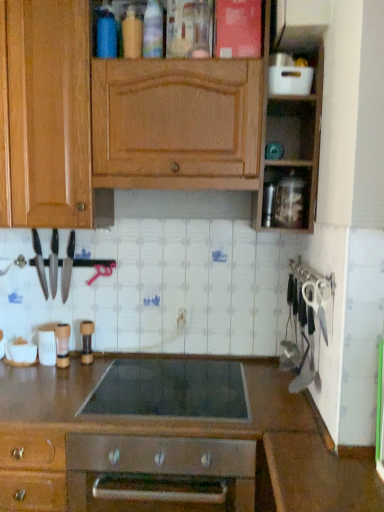
Question: Would you say wooden cabinet at upper center contains white plastic scissors at right?

Choices:
 (A) yes
 (B) no

Answer: (B)

Question: From a real-world perspective, is wooden cabinet at upper center physically below white plastic scissors at right?

Choices:
 (A) no
 (B) yes

Answer: (A)

Question: Could you tell me if wooden cabinet at upper center is turned towards white plastic scissors at right?

Choices:
 (A) yes
 (B) no

Answer: (B)

Question: Is wooden cabinet at upper center positioned far away from white plastic scissors at right?

Choices:
 (A) yes
 (B) no

Answer: (B)

Question: Does wooden cabinet at upper center have a greater width compared to white plastic scissors at right?

Choices:
 (A) yes
 (B) no

Answer: (A)

Question: Considering the positions of point (43, 270) and point (66, 326), is point (43, 270) closer or farther from the camera than point (66, 326)?

Choices:
 (A) farther
 (B) closer

Answer: (B)

Question: Which is correct: black metal knife at left, which ranks as the first kitchen appliance in left-to-right order, is inside clear plastic container at lower left, acting as the 4th appliance starting from the top, or outside of it?

Choices:
 (A) outside
 (B) inside

Answer: (A)

Question: In terms of height, does black metal knife at left, which ranks as the first kitchen appliance in left-to-right order, look taller or shorter compared to clear plastic container at lower left, the 3th appliance when ordered from left to right?

Choices:
 (A) short
 (B) tall

Answer: (B)

Question: From a real-world perspective, is black metal knife at left, which ranks as the first kitchen appliance in left-to-right order, positioned above or below clear plastic container at lower left, acting as the 4th appliance starting from the top?

Choices:
 (A) above
 (B) below

Answer: (A)

Question: Considering the positions of polished stainless steel knives at left, the first kitchen appliance viewed from the right, and white plastic scissors at right in the image, is polished stainless steel knives at left, the first kitchen appliance viewed from the right, taller or shorter than white plastic scissors at right?

Choices:
 (A) tall
 (B) short

Answer: (A)

Question: Which is correct: polished stainless steel knives at left, the first kitchen appliance viewed from the right, is inside white plastic scissors at right, or outside of it?

Choices:
 (A) inside
 (B) outside

Answer: (B)

Question: Is polished stainless steel knives at left, the 3th kitchen appliance positioned from the left, bigger or smaller than white plastic scissors at right?

Choices:
 (A) small
 (B) big

Answer: (B)

Question: Does point (61, 267) appear closer or farther from the camera than point (317, 309)?

Choices:
 (A) farther
 (B) closer

Answer: (A)

Question: From a real-world perspective, is polished stainless steel knives at left, the first kitchen appliance viewed from the right, above or below brown matte pepper grinder at center, which is the fourth appliance from bottom to top?

Choices:
 (A) below
 (B) above

Answer: (B)

Question: Considering the positions of point (69, 283) and point (89, 352), is point (69, 283) closer or farther from the camera than point (89, 352)?

Choices:
 (A) farther
 (B) closer

Answer: (B)